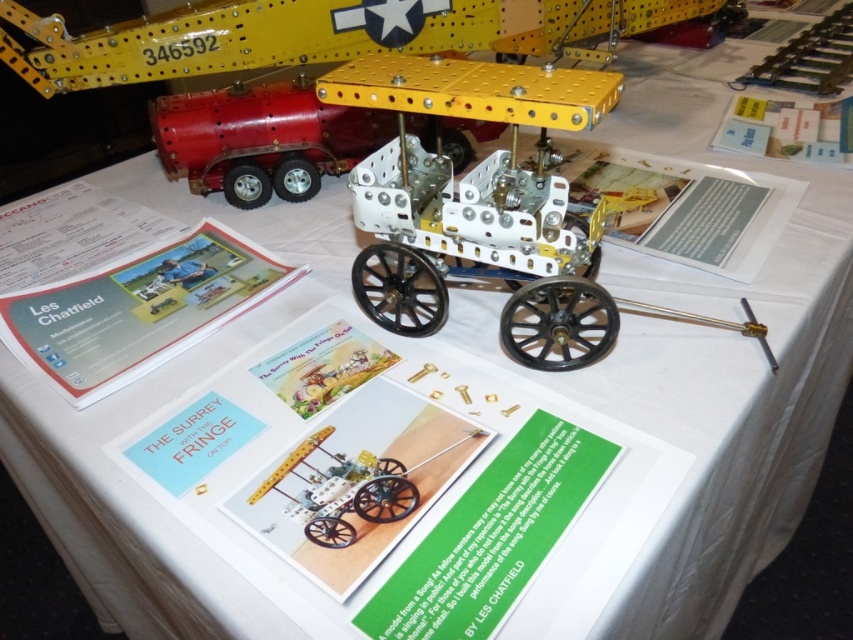
In the scene shown: Which of these two, metallic yellow frame at center or metallic red trailer at upper left, stands taller?

metallic yellow frame at center is taller.

Is point (523, 196) positioned after point (498, 131)?

No.

This screenshot has height=640, width=853. In order to click on metallic yellow frame at center in this screenshot , I will do `click(486, 208)`.